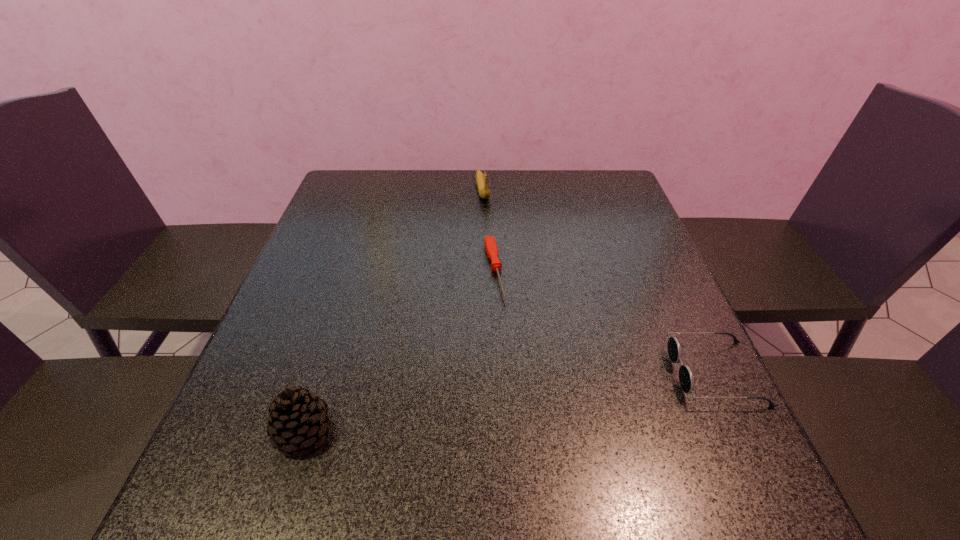
The image size is (960, 540). I want to click on empty space between the screwdriver and the rightmost object, so click(605, 322).

At what (x,y) coordinates should I click in order to perform the action: click on blank region between the banana and the screwdriver. Please return your answer as a coordinate pair (x, y). This screenshot has width=960, height=540. Looking at the image, I should click on (489, 231).

The height and width of the screenshot is (540, 960). Identify the location of free space that is in between the sunglasses and the shortest object. (605, 322).

Where is `vacant area that lies between the second shortest object and the screwdriver`? The height and width of the screenshot is (540, 960). vacant area that lies between the second shortest object and the screwdriver is located at coordinates (605, 322).

Identify the location of vacant area that lies between the leftmost object and the third tallest object. This screenshot has width=960, height=540. (510, 402).

The width and height of the screenshot is (960, 540). I want to click on unoccupied area between the farthest object and the pinecone, so click(394, 311).

The height and width of the screenshot is (540, 960). Find the location of `vacant area between the banana and the screwdriver`. vacant area between the banana and the screwdriver is located at coordinates 489,231.

What are the coordinates of `empty location between the leftmost object and the screwdriver` in the screenshot? It's located at (399, 351).

At what (x,y) coordinates should I click in order to perform the action: click on vacant area between the pinecone and the third tallest object. Please return your answer as a coordinate pair (x, y). Looking at the image, I should click on (510, 402).

Locate an element on the screen. Image resolution: width=960 pixels, height=540 pixels. object identified as the third closest to the leftmost object is located at coordinates (481, 179).